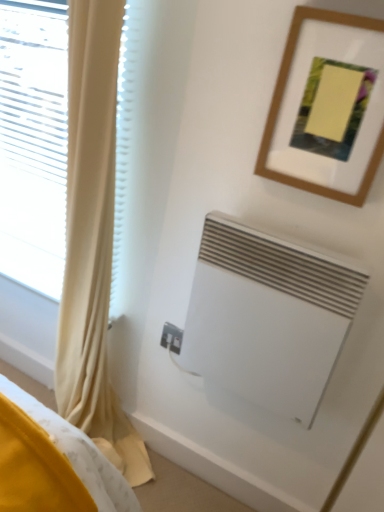
Question: Is wooden picture frame at upper right smaller than white matte air conditioning at lower right?

Choices:
 (A) yes
 (B) no

Answer: (A)

Question: Is wooden picture frame at upper right bigger than white matte air conditioning at lower right?

Choices:
 (A) no
 (B) yes

Answer: (A)

Question: Is wooden picture frame at upper right to the right of white matte air conditioning at lower right from the viewer's perspective?

Choices:
 (A) yes
 (B) no

Answer: (A)

Question: Is wooden picture frame at upper right shorter than white matte air conditioning at lower right?

Choices:
 (A) no
 (B) yes

Answer: (B)

Question: From a real-world perspective, does wooden picture frame at upper right stand above white matte air conditioning at lower right?

Choices:
 (A) yes
 (B) no

Answer: (A)

Question: In terms of size, does yellow fabric curtain at left appear bigger or smaller than wooden picture frame at upper right?

Choices:
 (A) big
 (B) small

Answer: (A)

Question: Considering the positions of yellow fabric curtain at left and wooden picture frame at upper right in the image, is yellow fabric curtain at left taller or shorter than wooden picture frame at upper right?

Choices:
 (A) short
 (B) tall

Answer: (B)

Question: From the image's perspective, is yellow fabric curtain at left located above or below wooden picture frame at upper right?

Choices:
 (A) above
 (B) below

Answer: (B)

Question: Considering the positions of yellow fabric curtain at left and wooden picture frame at upper right in the image, is yellow fabric curtain at left wider or thinner than wooden picture frame at upper right?

Choices:
 (A) wide
 (B) thin

Answer: (A)

Question: From a real-world perspective, relative to yellow fabric curtain at left, is wooden picture frame at upper right vertically above or below?

Choices:
 (A) below
 (B) above

Answer: (B)

Question: Considering the relative positions of wooden picture frame at upper right and yellow fabric curtain at left in the image provided, is wooden picture frame at upper right to the left or to the right of yellow fabric curtain at left?

Choices:
 (A) right
 (B) left

Answer: (A)

Question: Is point (276, 99) closer or farther from the camera than point (140, 442)?

Choices:
 (A) closer
 (B) farther

Answer: (A)

Question: From their relative heights in the image, would you say wooden picture frame at upper right is taller or shorter than yellow fabric curtain at left?

Choices:
 (A) tall
 (B) short

Answer: (B)

Question: Considering the positions of white matte air conditioning at lower right and yellow fabric curtain at left in the image, is white matte air conditioning at lower right taller or shorter than yellow fabric curtain at left?

Choices:
 (A) short
 (B) tall

Answer: (A)

Question: Based on their sizes in the image, would you say white matte air conditioning at lower right is bigger or smaller than yellow fabric curtain at left?

Choices:
 (A) big
 (B) small

Answer: (B)